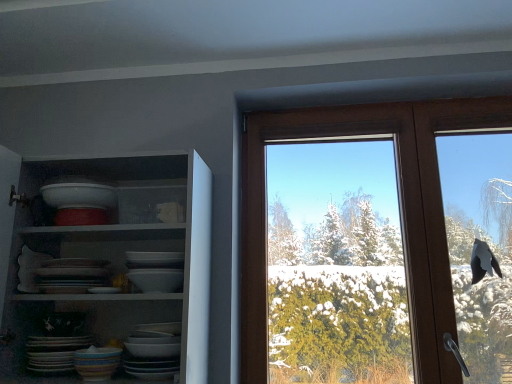
Question: Is multicolored ceramic bowl at lower left not within white glossy shelves at upper left?

Choices:
 (A) yes
 (B) no

Answer: (B)

Question: Is multicolored ceramic bowl at lower left smaller than white glossy shelves at upper left?

Choices:
 (A) no
 (B) yes

Answer: (B)

Question: From a real-world perspective, is multicolored ceramic bowl at lower left located higher than white glossy shelves at upper left?

Choices:
 (A) yes
 (B) no

Answer: (B)

Question: Could white glossy shelves at upper left be considered to be inside multicolored ceramic bowl at lower left?

Choices:
 (A) yes
 (B) no

Answer: (B)

Question: Is the depth of multicolored ceramic bowl at lower left greater than that of white glossy shelves at upper left?

Choices:
 (A) no
 (B) yes

Answer: (B)

Question: From a real-world perspective, is multicolored ceramic bowl at lower left under white glossy shelves at upper left?

Choices:
 (A) yes
 (B) no

Answer: (A)

Question: Is white glossy shelves at upper left located outside matte ceramic platter at lower left?

Choices:
 (A) yes
 (B) no

Answer: (A)

Question: Is white glossy shelves at upper left oriented towards matte ceramic platter at lower left?

Choices:
 (A) yes
 (B) no

Answer: (B)

Question: Does white glossy shelves at upper left have a greater width compared to matte ceramic platter at lower left?

Choices:
 (A) no
 (B) yes

Answer: (B)

Question: From a real-world perspective, is white glossy shelves at upper left beneath matte ceramic platter at lower left?

Choices:
 (A) yes
 (B) no

Answer: (B)

Question: From the image's perspective, is white glossy shelves at upper left on top of matte ceramic platter at lower left?

Choices:
 (A) yes
 (B) no

Answer: (A)

Question: Is white glossy shelves at upper left thinner than matte ceramic platter at lower left?

Choices:
 (A) no
 (B) yes

Answer: (A)

Question: Does matte ceramic platter at lower left have a smaller size compared to multicolored ceramic bowl at lower left?

Choices:
 (A) yes
 (B) no

Answer: (B)